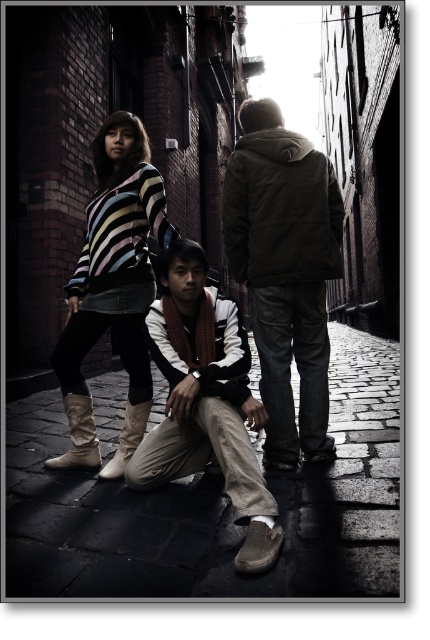
Is point (267, 232) more distant than point (86, 314)?

Yes, it is behind point (86, 314).

Does dark brown leather jacket at center appear over striped sweater at center?

Yes.

This screenshot has width=430, height=640. What do you see at coordinates (285, 273) in the screenshot?
I see `dark brown leather jacket at center` at bounding box center [285, 273].

Locate an element on the screen. Image resolution: width=430 pixels, height=640 pixels. dark brown leather jacket at center is located at coordinates (285, 273).

Is dark stone pavement at center positioned behind striped sweater at center?

No.

This screenshot has width=430, height=640. What do you see at coordinates (215, 506) in the screenshot?
I see `dark stone pavement at center` at bounding box center [215, 506].

Which is in front, point (383, 454) or point (98, 200)?

Positioned in front is point (98, 200).

What are the coordinates of `dark stone pavement at center` in the screenshot? It's located at (215, 506).

Which is behind, point (297, 353) or point (135, 481)?

The point (297, 353) is behind.

Is dark brown leather jacket at center shorter than tan suede scarf at center?

Incorrect, dark brown leather jacket at center's height does not fall short of tan suede scarf at center's.

Between point (288, 349) and point (190, 356), which one is positioned in front?

Point (190, 356) is in front.

Where is `dark brown leather jacket at center`? dark brown leather jacket at center is located at coordinates (285, 273).